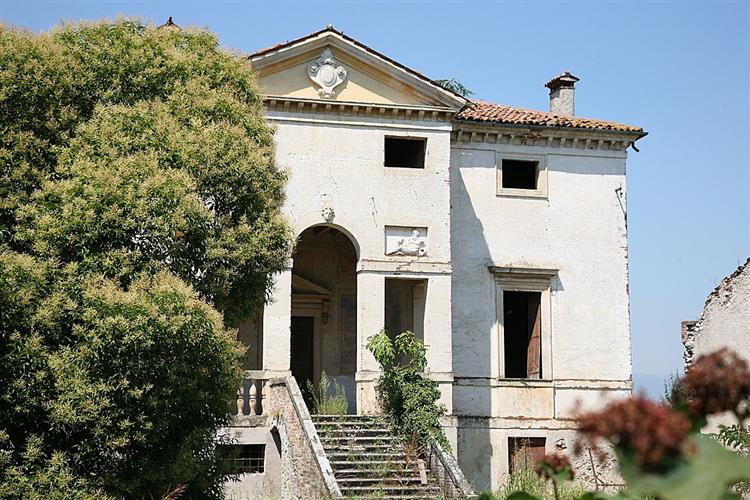
Locate an element on the screen. Image resolution: width=750 pixels, height=500 pixels. chimney is located at coordinates (565, 91).